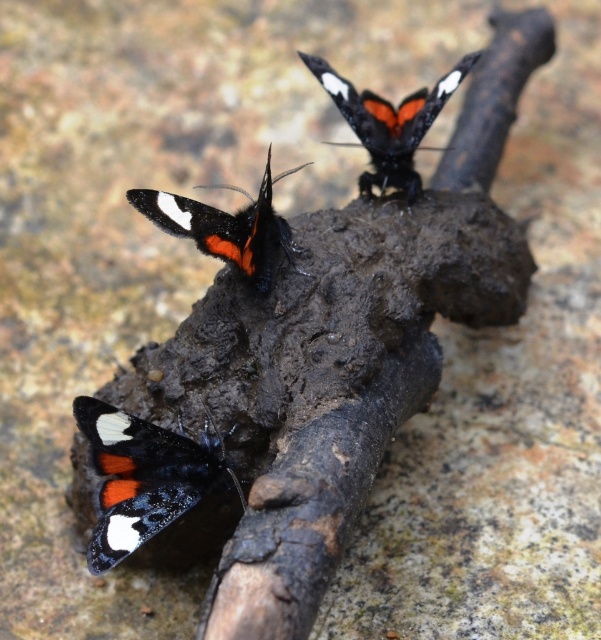
Question: Among these points, which one is nearest to the camera?

Choices:
 (A) (117, 440)
 (B) (371, 154)
 (C) (163, 228)

Answer: (A)

Question: Is matte black butterfly at lower left to the left of black glossy butterfly at center from the viewer's perspective?

Choices:
 (A) no
 (B) yes

Answer: (B)

Question: Considering the relative positions of matte black butterfly at lower left and matte black butterfly at upper center in the image provided, where is matte black butterfly at lower left located with respect to matte black butterfly at upper center?

Choices:
 (A) right
 (B) left

Answer: (B)

Question: Among these points, which one is farthest from the camera?

Choices:
 (A) (186, 486)
 (B) (394, 164)
 (C) (200, 221)

Answer: (B)

Question: Which of the following is the farthest from the observer?

Choices:
 (A) (120, 436)
 (B) (233, 253)
 (C) (328, 68)

Answer: (C)

Question: From the image, what is the correct spatial relationship of black glossy butterfly at center in relation to matte black butterfly at upper center?

Choices:
 (A) right
 (B) left

Answer: (B)